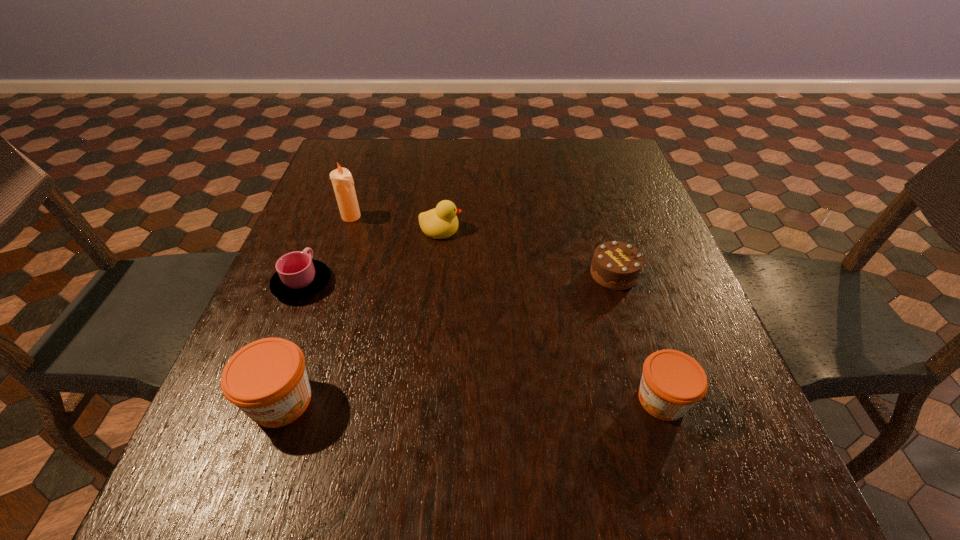
Point out which object is positioned as the third nearest to the chocolate cake. Please provide its 2D coordinates. Your answer should be formatted as a tuple, i.e. [(x, y)], where the tuple contains the x and y coordinates of a point satisfying the conditions above.

[(267, 379)]

Locate an element on the screen. This screenshot has height=540, width=960. vacant space that satisfies the following two spatial constraints: 1. on the side with the handle of the tallest object; 2. on the left side of the shortest object is located at coordinates (329, 217).

You are a GUI agent. You are given a task and a screenshot of the screen. Output one action in this format:
    pyautogui.click(x=<x>, y=<y>)
    Task: Click on the free spot that satisfies the following two spatial constraints: 1. on the side with the handle of the shortest object; 2. on the right side of the candle
    
    Given the screenshot: What is the action you would take?
    pyautogui.click(x=329, y=217)

This screenshot has height=540, width=960. What are the coordinates of `vacant space that satisfies the following two spatial constraints: 1. on the face of the duckling; 2. on the front label of the second tallest object` in the screenshot? It's located at point(423,401).